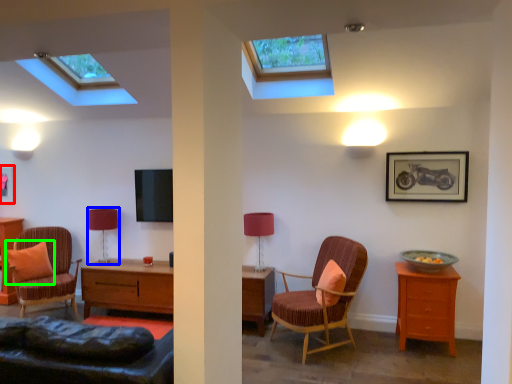
Question: Which is nearer to the picture frame (highlighted by a red box)? table lamp (highlighted by a blue box) or pillow (highlighted by a green box).

Choices:
 (A) table lamp
 (B) pillow

Answer: (B)